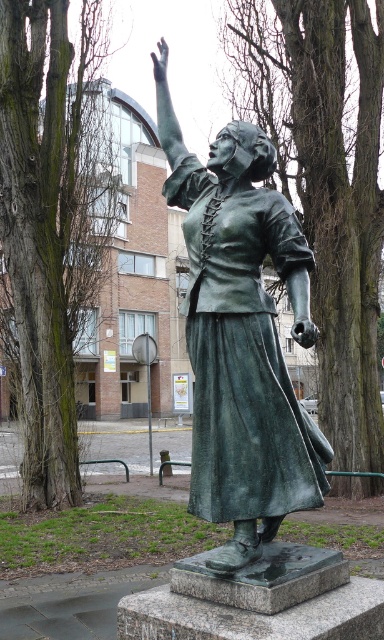
You are a painter standing 5 meters away from the green patina statue at center. You want to paint both the statue and the green textured tree at center in your painting. Can you fit both in your canvas if your canvas is 10 meters wide?

The distance between the green patina statue at center and the green textured tree at center is 8.95 meters. Since your canvas is 10 meters wide, which is wider than the 8.95 meters separating them, you can fit both in your canvas.

You are an art student trying to sketch the statue from the perspective of someone standing directly in front of it. You notice two points marked on the statue. Which of the two points, point (x=264, y=248) or point (x=29, y=433), is closer to you when viewed from this position?

Point (x=264, y=248) is in front of point (x=29, y=433), so it is closer to you when viewed from the front of the statue.